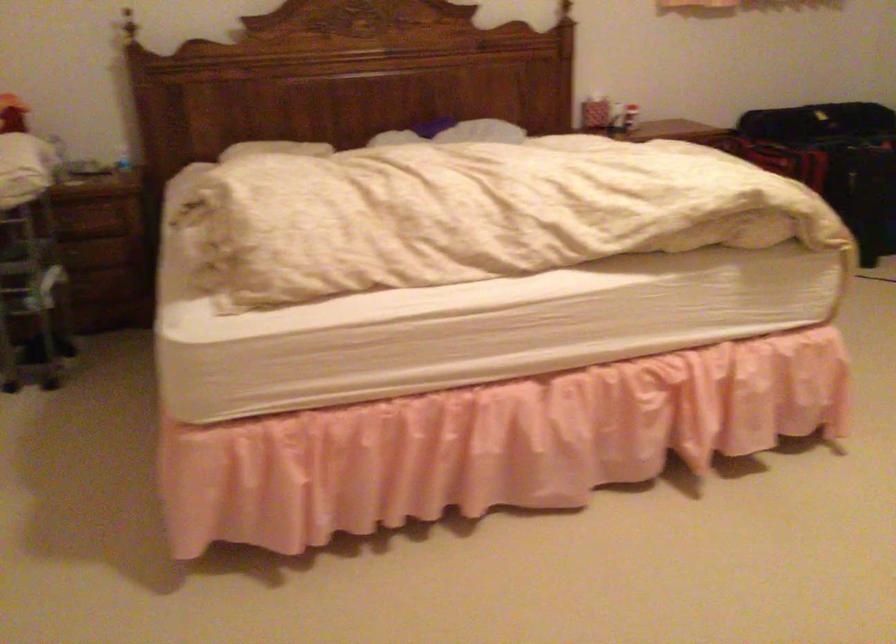
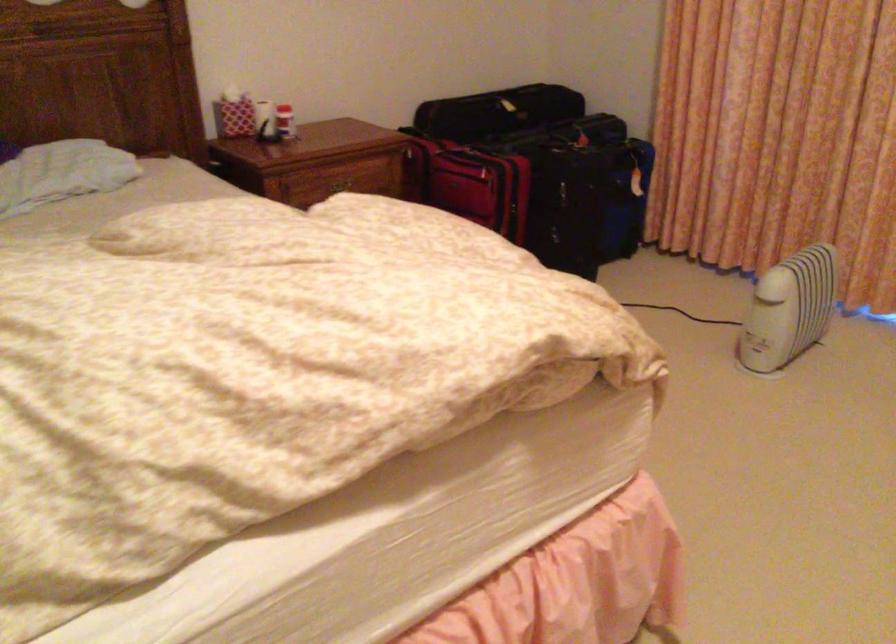
In the second image, find the point that corresponds to (634,93) in the first image.

(285, 122)